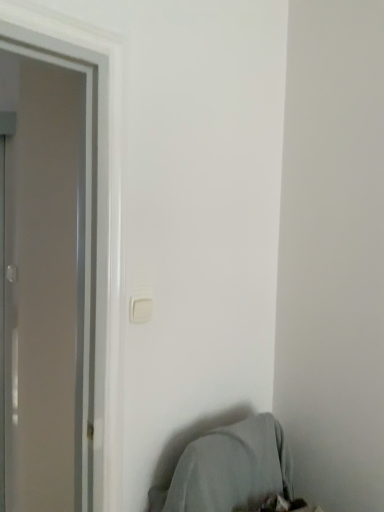
Question: Is gray fabric bean bag chair at lower right to the left of white plastic light switch at center from the viewer's perspective?

Choices:
 (A) no
 (B) yes

Answer: (A)

Question: Does gray fabric bean bag chair at lower right have a larger size compared to white plastic light switch at center?

Choices:
 (A) no
 (B) yes

Answer: (B)

Question: Considering the relative positions of gray fabric bean bag chair at lower right and white plastic light switch at center in the image provided, is gray fabric bean bag chair at lower right to the right of white plastic light switch at center from the viewer's perspective?

Choices:
 (A) yes
 (B) no

Answer: (A)

Question: Is white plastic light switch at center at the back of gray fabric bean bag chair at lower right?

Choices:
 (A) no
 (B) yes

Answer: (A)

Question: Is gray fabric bean bag chair at lower right with white plastic light switch at center?

Choices:
 (A) no
 (B) yes

Answer: (A)

Question: Is gray fabric bean bag chair at lower right taller than white plastic light switch at center?

Choices:
 (A) yes
 (B) no

Answer: (A)

Question: Is white plastic light switch at center outside of gray fabric bean bag chair at lower right?

Choices:
 (A) no
 (B) yes

Answer: (B)

Question: Could you tell me if white plastic light switch at center is turned towards gray fabric bean bag chair at lower right?

Choices:
 (A) yes
 (B) no

Answer: (B)

Question: Can you confirm if white plastic light switch at center is shorter than gray fabric bean bag chair at lower right?

Choices:
 (A) yes
 (B) no

Answer: (A)

Question: Does white plastic light switch at center have a lesser width compared to gray fabric bean bag chair at lower right?

Choices:
 (A) yes
 (B) no

Answer: (A)

Question: Can you confirm if white plastic light switch at center is positioned to the left of gray fabric bean bag chair at lower right?

Choices:
 (A) no
 (B) yes

Answer: (B)

Question: From the image's perspective, does white plastic light switch at center appear lower than gray fabric bean bag chair at lower right?

Choices:
 (A) yes
 (B) no

Answer: (B)

Question: From the image's perspective, is white plastic light switch at center located above or below gray fabric bean bag chair at lower right?

Choices:
 (A) below
 (B) above

Answer: (B)